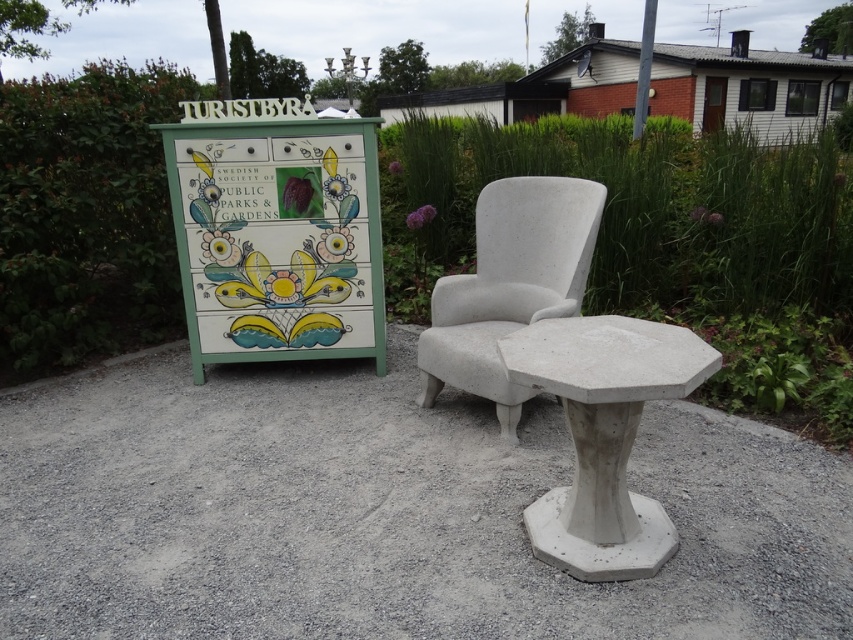
You are a visitor at the park and want to sit down at the gray concrete table at center. However, you notice the white concrete chair at center is in the way. Can you move the chair to access the table?

The gray concrete table at center is positioned under the white concrete chair at center, so you cannot move the chair to access the table because the table is already underneath it.

You are a visitor at a park and want to place a 1.2 meter tall sculpture on either the gray concrete table at center or the painted wood signboard at left. Based on their heights, which surface can safely support the sculpture without it toppling over?

The gray concrete table at center is shorter than the painted wood signboard at left. Since the sculpture is 1.2 meters tall, placing it on the taller painted wood signboard at left would provide a more stable base to prevent toppling.

You are standing at the point with coordinates point (527, 289) and want to walk towards the point (354, 573). Which direction should you face to walk straight towards it?

You should face towards the direction of the point (354, 573) because it is in front of point (527, 289).